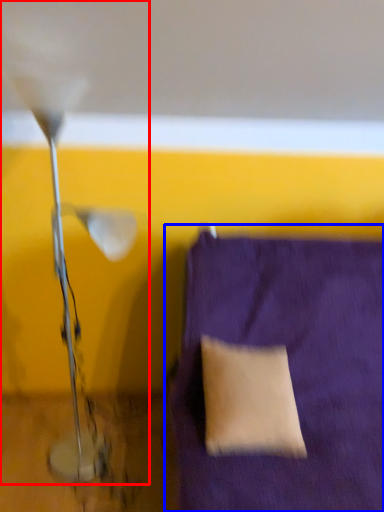
Question: Which of the following is the farthest to the observer, lamp (highlighted by a red box) or furniture (highlighted by a blue box)?

Choices:
 (A) lamp
 (B) furniture

Answer: (A)